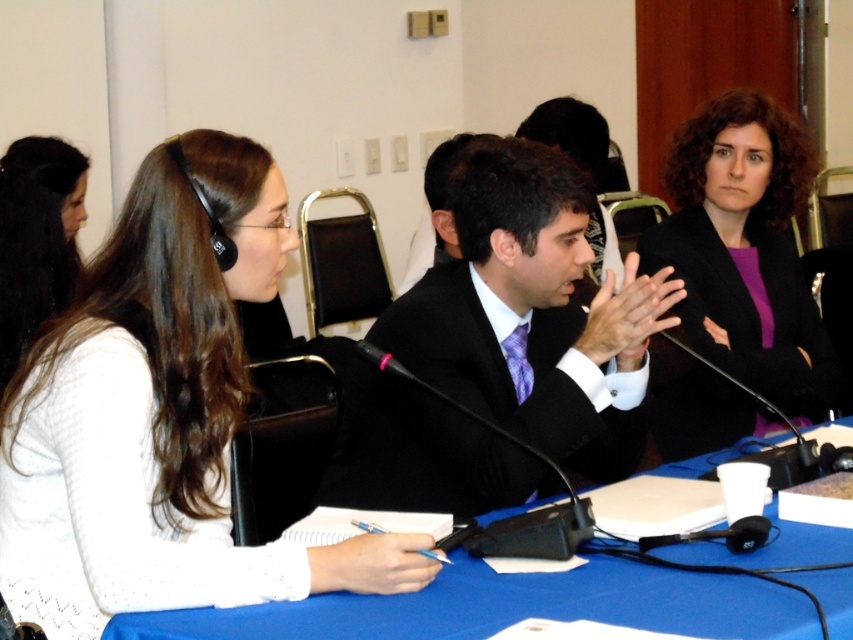
You are organizing a conference and need to place a name tag for the speaker wearing the purple matte blazer at upper right. Where should you place the name tag on the table?

The purple matte blazer at upper right is located at point (746, 250), so the name tag should be placed at that coordinate on the table.

You are standing at the entrance of the conference room and see two points marked on the floor. The first point is at position point (683, 192) and the second is at point (701, 456). Which point is closer to the door?

Point (701, 456) is closer to the door because point (683, 192) is behind it.